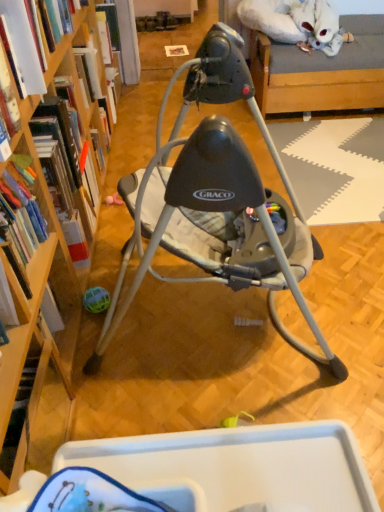
Question: Is the depth of hardcover book at upper left, the first book when ordered from top to bottom, less than that of matte gray baby swing at center?

Choices:
 (A) yes
 (B) no

Answer: (B)

Question: Can you confirm if hardcover book at upper left, the first book when ordered from top to bottom, is bigger than matte gray baby swing at center?

Choices:
 (A) yes
 (B) no

Answer: (B)

Question: Would you say matte gray baby swing at center is part of hardcover book at upper left, which is the 1th book from back to front,'s contents?

Choices:
 (A) no
 (B) yes

Answer: (A)

Question: Is hardcover book at upper left, which is the 1th book from back to front, wider than matte gray baby swing at center?

Choices:
 (A) no
 (B) yes

Answer: (A)

Question: Could you tell me if hardcover book at upper left, the first book when ordered from top to bottom, is turned towards matte gray baby swing at center?

Choices:
 (A) yes
 (B) no

Answer: (B)

Question: Is hardcover book at left, the 3th book positioned from the back, bigger or smaller than hardcover book at left, placed as the 4th book when sorted from back to front?

Choices:
 (A) big
 (B) small

Answer: (B)

Question: In terms of height, does hardcover book at left, which appears as the 3th book when ordered from the bottom, look taller or shorter compared to hardcover book at left, the 1th book from the front?

Choices:
 (A) short
 (B) tall

Answer: (A)

Question: Is hardcover book at left, which appears as the 3th book when ordered from the bottom, to the left or to the right of hardcover book at left, the 1th book from the front, in the image?

Choices:
 (A) right
 (B) left

Answer: (B)

Question: From a real-world perspective, is hardcover book at left, which appears as the 3th book when ordered from the bottom, positioned above or below hardcover book at left, the 1th book from the front?

Choices:
 (A) above
 (B) below

Answer: (A)

Question: Considering the relative positions of hardcover book at left, placed as the 4th book when sorted from back to front, and hardcover book at left, which is the second book in top-to-bottom order, in the image provided, is hardcover book at left, placed as the 4th book when sorted from back to front, to the left or to the right of hardcover book at left, which is the second book in top-to-bottom order,?

Choices:
 (A) right
 (B) left

Answer: (A)

Question: Considering the positions of hardcover book at left, the 1th book from the front, and hardcover book at left, which is the 2th book in front-to-back order, in the image, is hardcover book at left, the 1th book from the front, taller or shorter than hardcover book at left, which is the 2th book in front-to-back order,?

Choices:
 (A) tall
 (B) short

Answer: (A)

Question: Choose the correct answer: Is hardcover book at left, the 1th book from the front, inside hardcover book at left, which is the 2th book in front-to-back order, or outside it?

Choices:
 (A) outside
 (B) inside

Answer: (A)

Question: Looking at the image, does hardcover book at left, which is the first book from bottom to top, seem bigger or smaller compared to hardcover book at left, which appears as the 3th book when ordered from the bottom?

Choices:
 (A) small
 (B) big

Answer: (B)

Question: Considering the positions of hardcover book at upper left, which ranks as the fourth book in front-to-back order, and hardcover book at left, arranged as the third book when viewed from the front, in the image, is hardcover book at upper left, which ranks as the fourth book in front-to-back order, bigger or smaller than hardcover book at left, arranged as the third book when viewed from the front,?

Choices:
 (A) small
 (B) big

Answer: (A)

Question: Is hardcover book at upper left, the fourth book from the bottom, inside or outside of hardcover book at left, which appears as the 3th book when viewed from the top?

Choices:
 (A) outside
 (B) inside

Answer: (A)